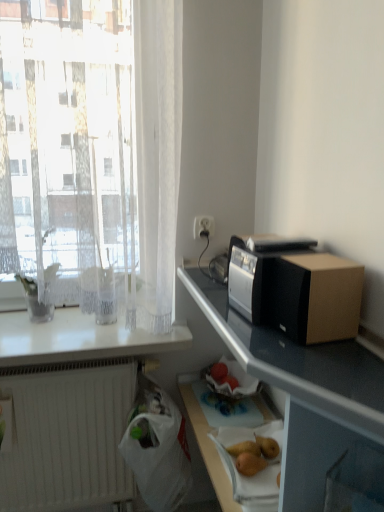
Question: Is point (86, 400) positioned closer to the camera than point (140, 467)?

Choices:
 (A) closer
 (B) farther

Answer: (B)

Question: Which is correct: white matte radiator at lower left is inside white plastic bag at lower center, or outside of it?

Choices:
 (A) inside
 (B) outside

Answer: (B)

Question: Which object is positioned closest to the smooth brown pear at lower center?

Choices:
 (A) white matte radiator at lower left
 (B) black plastic microwave at right
 (C) brown cardboard box at right
 (D) white plastic electric outlet at upper center
 (E) white glossy countertop at upper left

Answer: (B)

Question: Considering the real-world distances, which object is closest to the brown cardboard box at right?

Choices:
 (A) white plastic electric outlet at upper center
 (B) white matte radiator at lower left
 (C) black plastic microwave at right
 (D) white plastic bag at lower center
 (E) white glossy countertop at upper left

Answer: (C)